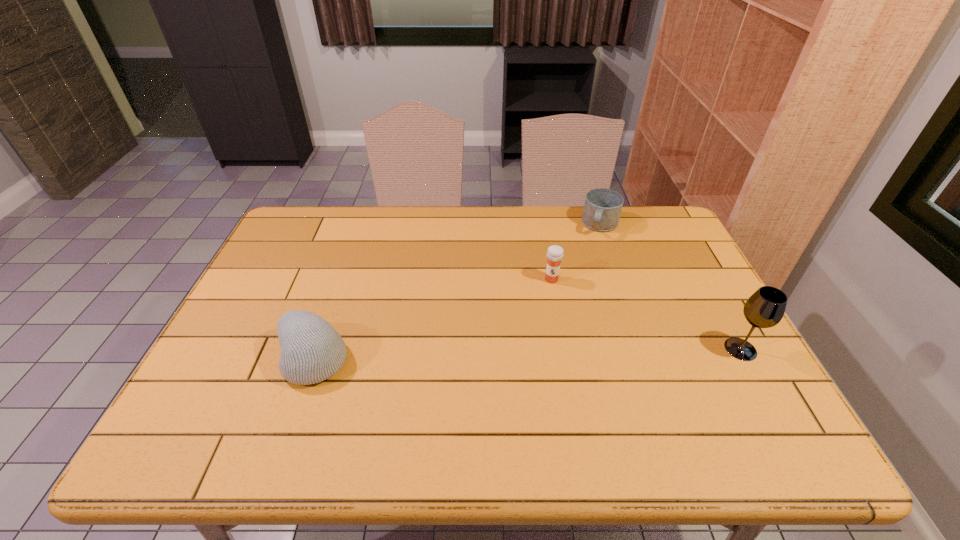
In order to click on the leftmost object in this screenshot , I will do `click(312, 351)`.

Identify the location of the rightmost object. (765, 308).

At what (x,y) coordinates should I click in order to perform the action: click on the tallest object. Please return your answer as a coordinate pair (x, y). The height and width of the screenshot is (540, 960). Looking at the image, I should click on (765, 308).

You are a GUI agent. You are given a task and a screenshot of the screen. Output one action in this format:
    pyautogui.click(x=<x>, y=<y>)
    Task: Click on the second farthest object
    This screenshot has width=960, height=540.
    Given the screenshot: What is the action you would take?
    pyautogui.click(x=555, y=253)

At what (x,y) coordinates should I click in order to perform the action: click on medicine. Please return your answer as a coordinate pair (x, y). The width and height of the screenshot is (960, 540). Looking at the image, I should click on (555, 253).

Image resolution: width=960 pixels, height=540 pixels. Identify the location of the third object from left to right. (602, 208).

This screenshot has width=960, height=540. I want to click on mug, so click(602, 208).

In order to click on vacant point located on the right of the leftmost object in this screenshot , I will do `click(376, 359)`.

Where is `free location located on the back of the rightmost object`? This screenshot has height=540, width=960. free location located on the back of the rightmost object is located at coordinates (692, 262).

The width and height of the screenshot is (960, 540). What are the coordinates of `vacant area situated 0.190m on the label side of the third object from right to left` in the screenshot? It's located at (540, 333).